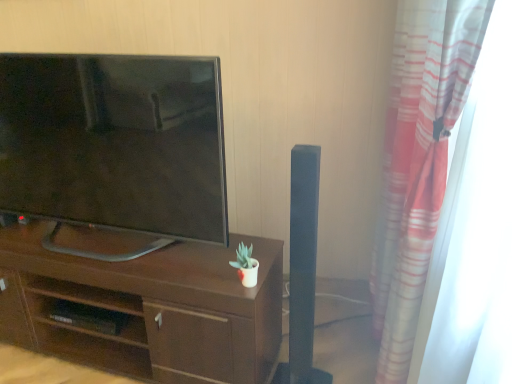
Question: Considering their positions, is striped fabric curtain at right located in front of or behind dark wood desk at center?

Choices:
 (A) behind
 (B) front

Answer: (B)

Question: Based on their sizes in the image, would you say striped fabric curtain at right is bigger or smaller than dark wood desk at center?

Choices:
 (A) big
 (B) small

Answer: (A)

Question: Which of these objects is positioned closest to the dark wood desk at center?

Choices:
 (A) striped fabric curtain at right
 (B) matte black tv at left

Answer: (B)

Question: Estimate the real-world distances between objects in this image. Which object is closer to the striped fabric curtain at right?

Choices:
 (A) dark wood desk at center
 (B) matte black tv at left

Answer: (A)